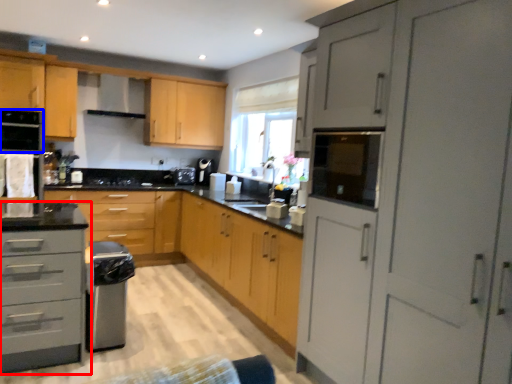
Question: Among these objects, which one is farthest to the camera, cabinetry (highlighted by a red box) or appliance (highlighted by a blue box)?

Choices:
 (A) cabinetry
 (B) appliance

Answer: (B)